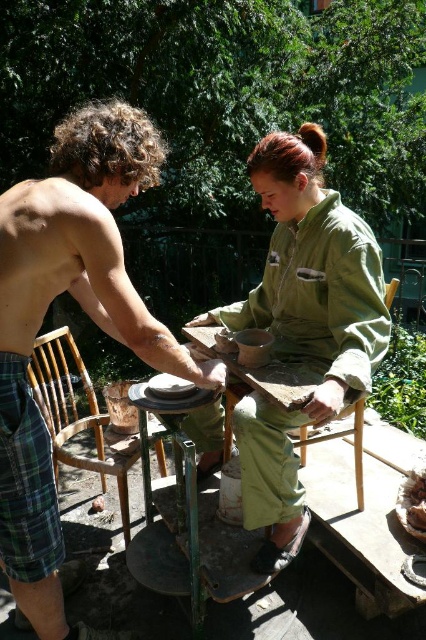
You are a photographer trying to capture a closeup of the brown crumbly bread at lower right without blocking the view of the green matte jumpsuit at center. Is this possible given their positions?

The green matte jumpsuit at center is in front of the brown crumbly bread at lower right, so you cannot capture a clear closeup of the brown crumbly bread at lower right without the green matte jumpsuit at center blocking the view.

You are standing in the garden where the pottery session is happening. There is a shiny metallic potter wheel at center. A point with coordinates (83, 310) is mentioned. Can you tell me where exactly this point is located in relation to the potter wheel?

The point with coordinates (83, 310) is located on the shiny metallic potter wheel at center.